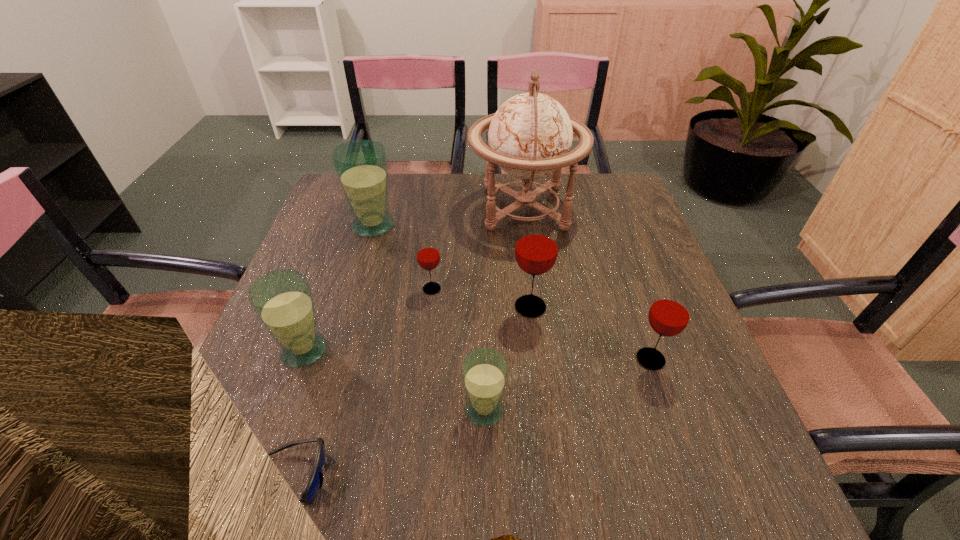
Locate an element on the screen. The height and width of the screenshot is (540, 960). object that is at the near left corner is located at coordinates (314, 483).

This screenshot has width=960, height=540. Identify the location of free region at the far edge of the desktop. click(432, 194).

The width and height of the screenshot is (960, 540). I want to click on vacant space at the near edge of the desktop, so click(495, 481).

Identify the location of free spot at the left edge of the desktop. (318, 231).

The height and width of the screenshot is (540, 960). In the image, there is a desktop. Identify the location of vacant space at the right edge. (642, 324).

In the image, there is a desktop. Where is `vacant space at the near left corner`? vacant space at the near left corner is located at coordinates (287, 467).

Locate an element on the screen. This screenshot has height=540, width=960. vacant space at the near right corner of the desktop is located at coordinates (672, 483).

Find the location of `vacant area that lies between the biggest blue glass and the rightmost object`. vacant area that lies between the biggest blue glass and the rightmost object is located at coordinates (512, 293).

Where is `vacant space that's between the nearest blue glass and the farthest blue glass`? The height and width of the screenshot is (540, 960). vacant space that's between the nearest blue glass and the farthest blue glass is located at coordinates (429, 318).

The image size is (960, 540). In order to click on vacant area that lies between the globe and the biggest blue glass in this screenshot , I will do `click(449, 217)`.